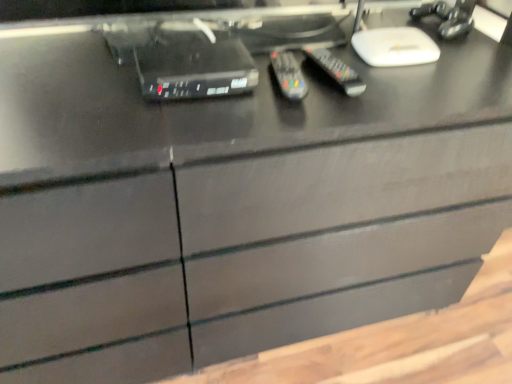
Question: From the image's perspective, is black plastic remote at center, acting as the first control starting from the right, positioned above or below black plastic remote at center, placed as the second control when sorted from right to left?

Choices:
 (A) below
 (B) above

Answer: (B)

Question: From a real-world perspective, is black plastic remote at center, the second control when ordered from left to right, above or below black plastic remote at center, placed as the 1th control when sorted from left to right?

Choices:
 (A) below
 (B) above

Answer: (B)

Question: Which object is the closest to the black plastic device at upper center?

Choices:
 (A) black plastic remote at center, placed as the second control when sorted from right to left
 (B) black plastic remote at center, acting as the first control starting from the right

Answer: (A)

Question: Which object is the closest to the black plastic remote at center, placed as the second control when sorted from right to left?

Choices:
 (A) black plastic remote at center, the second control when ordered from left to right
 (B) black plastic device at upper center

Answer: (A)